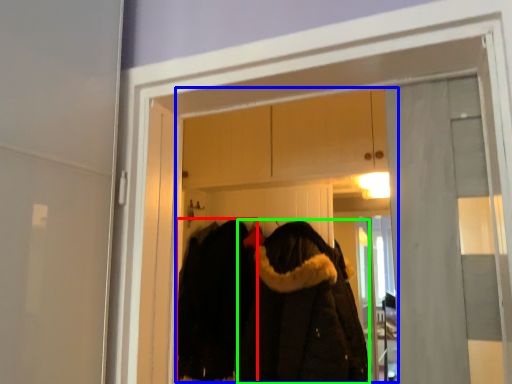
Question: Which is farther away from cloak (highlighted by a red box)? clothing store (highlighted by a blue box) or cloak (highlighted by a green box)?

Choices:
 (A) clothing store
 (B) cloak

Answer: (A)